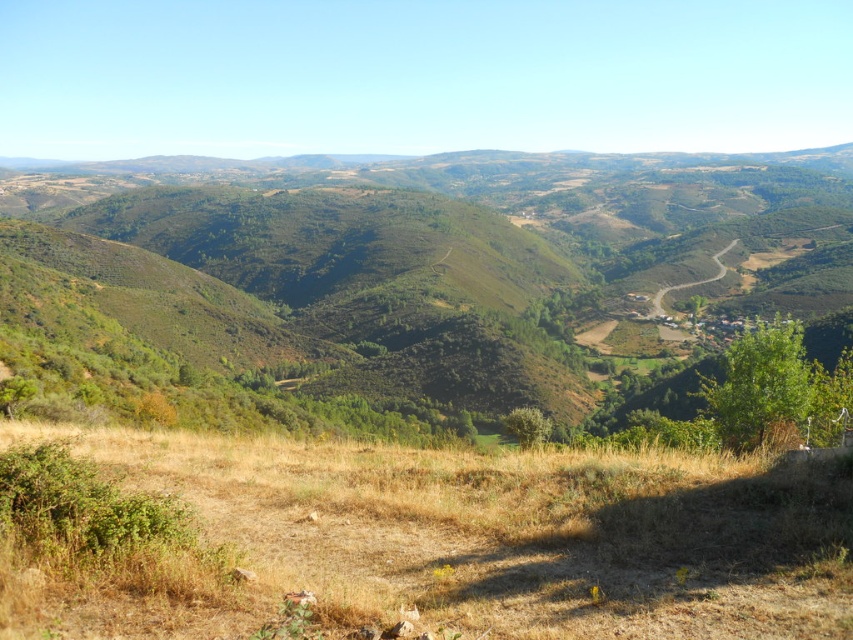
Between green leafy hillside at center and dry grass at lower center, which one has more height?

Standing taller between the two is green leafy hillside at center.

Which is above, green leafy hillside at center or dry grass at lower center?

green leafy hillside at center is higher up.

Find the location of a particular element. green leafy hillside at center is located at coordinates (415, 282).